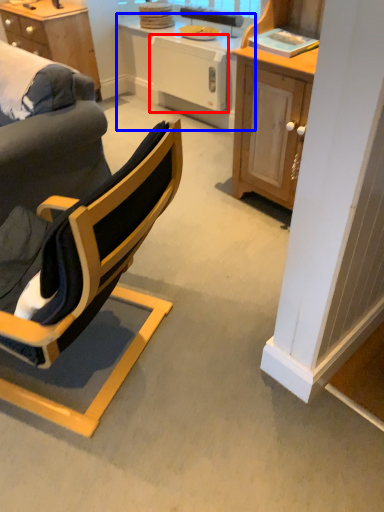
Question: Which point is further to the camera, dish washer (highlighted by a red box) or table (highlighted by a blue box)?

Choices:
 (A) dish washer
 (B) table

Answer: (A)